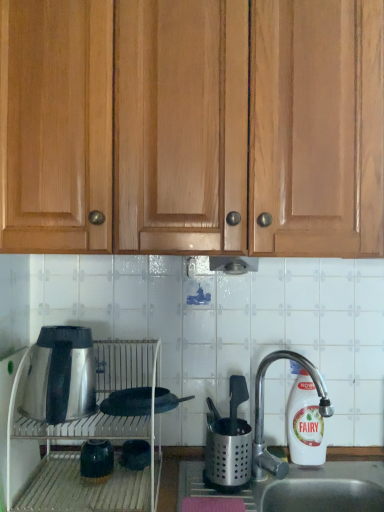
Question: Is matte green vase at lower left, which appears as the second appliance when viewed from the top, shorter than matte black pot at lower center, which is the 1th appliance in bottom-to-top order?

Choices:
 (A) no
 (B) yes

Answer: (A)

Question: Does matte green vase at lower left, the 2th appliance when ordered from bottom to top, have a greater width compared to matte black pot at lower center, positioned as the third appliance in top-to-bottom order?

Choices:
 (A) yes
 (B) no

Answer: (B)

Question: Is matte green vase at lower left, the 2th appliance when ordered from bottom to top, not inside matte black pot at lower center, positioned as the third appliance in top-to-bottom order?

Choices:
 (A) no
 (B) yes

Answer: (B)

Question: Is matte green vase at lower left, the 2th appliance when ordered from bottom to top, to the left of matte black pot at lower center, which is the 1th appliance in bottom-to-top order, from the viewer's perspective?

Choices:
 (A) no
 (B) yes

Answer: (B)

Question: Is matte green vase at lower left, which appears as the second appliance when viewed from the top, further to the viewer compared to matte black pot at lower center, which is the 1th appliance in bottom-to-top order?

Choices:
 (A) yes
 (B) no

Answer: (B)

Question: Is point (304, 399) closer or farther from the camera than point (96, 440)?

Choices:
 (A) closer
 (B) farther

Answer: (B)

Question: Considering their positions, is white plastic bottle at right located in front of or behind matte green vase at lower left, the 2th appliance when ordered from bottom to top?

Choices:
 (A) front
 (B) behind

Answer: (B)

Question: In terms of height, does white plastic bottle at right look taller or shorter compared to matte green vase at lower left, the 2th appliance when ordered from bottom to top?

Choices:
 (A) short
 (B) tall

Answer: (B)

Question: Would you say white plastic bottle at right is to the left or to the right of matte green vase at lower left, the 2th appliance when ordered from bottom to top, in the picture?

Choices:
 (A) right
 (B) left

Answer: (A)

Question: Considering the positions of light brown wood cabinets at upper center and black matte frying pan at center, the 1th appliance in the top-to-bottom sequence, in the image, is light brown wood cabinets at upper center taller or shorter than black matte frying pan at center, the 1th appliance in the top-to-bottom sequence,?

Choices:
 (A) tall
 (B) short

Answer: (A)

Question: From a real-world perspective, is light brown wood cabinets at upper center positioned above or below black matte frying pan at center, the 1th appliance in the top-to-bottom sequence?

Choices:
 (A) below
 (B) above

Answer: (B)

Question: In the image, is light brown wood cabinets at upper center positioned in front of or behind black matte frying pan at center, the 1th appliance in the top-to-bottom sequence?

Choices:
 (A) behind
 (B) front

Answer: (B)

Question: Choose the correct answer: Is light brown wood cabinets at upper center inside black matte frying pan at center, the 1th appliance in the top-to-bottom sequence, or outside it?

Choices:
 (A) inside
 (B) outside

Answer: (B)

Question: From the image's perspective, is matte green vase at lower left, the 2th appliance when ordered from bottom to top, above or below matte black pot at lower center, which is the 1th appliance in bottom-to-top order?

Choices:
 (A) above
 (B) below

Answer: (A)

Question: From a real-world perspective, relative to matte black pot at lower center, positioned as the third appliance in top-to-bottom order, is matte green vase at lower left, the 2th appliance when ordered from bottom to top, vertically above or below?

Choices:
 (A) below
 (B) above

Answer: (B)